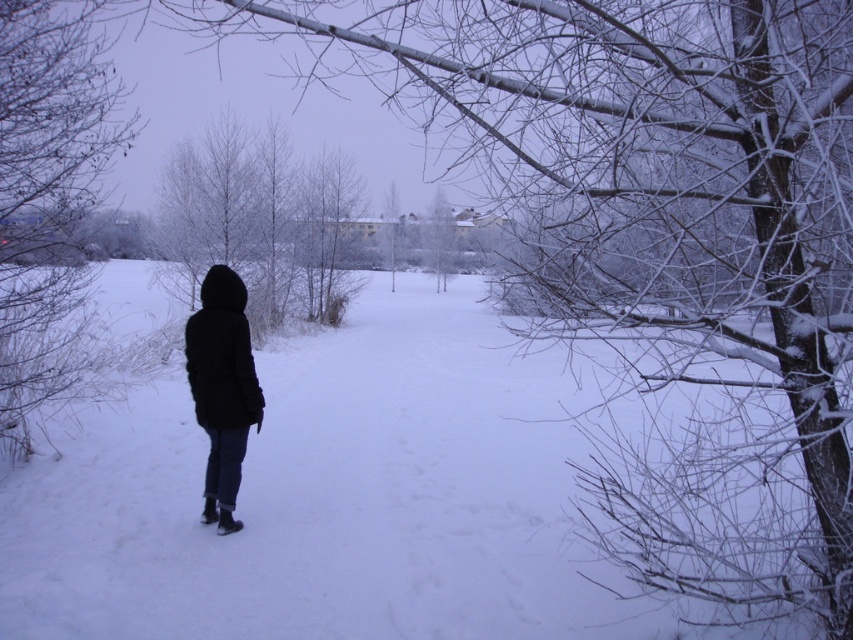
Consider the image. Who is higher up, white frosty branches at left or black matte coat at center?

Positioned higher is white frosty branches at left.

Who is positioned more to the right, white frosty branches at left or black matte coat at center?

black matte coat at center

Image resolution: width=853 pixels, height=640 pixels. In order to click on white frosty branches at left in this screenshot , I will do `click(48, 200)`.